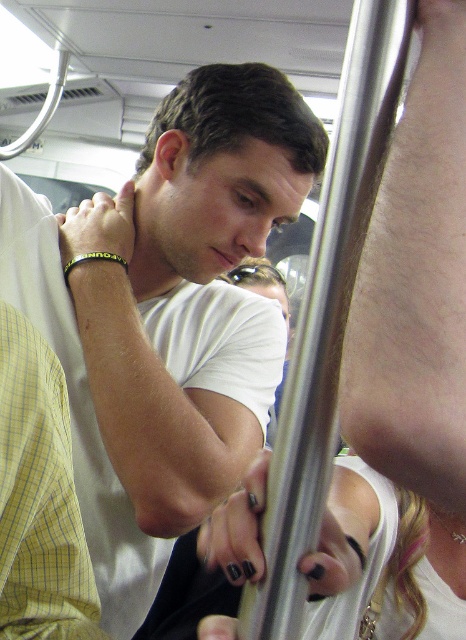
Is white matte t-shirt at center positioned behind black rubber bracelet at upper left?

That is False.

Is point (165, 272) closer to viewer compared to point (123, 260)?

No, (165, 272) is behind (123, 260).

This screenshot has height=640, width=466. What are the coordinates of `white matte t-shirt at center` in the screenshot? It's located at (165, 316).